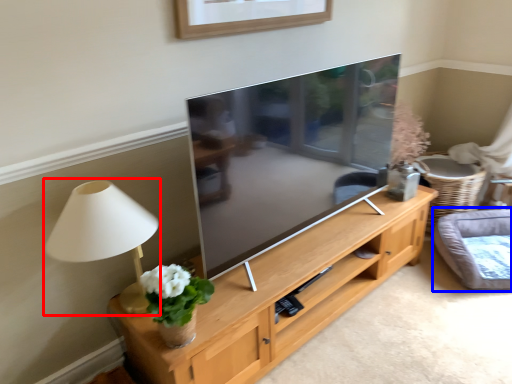
Question: Among these objects, which one is nearest to the camera, table lamp (highlighted by a red box) or cat bed (highlighted by a blue box)?

Choices:
 (A) table lamp
 (B) cat bed

Answer: (A)